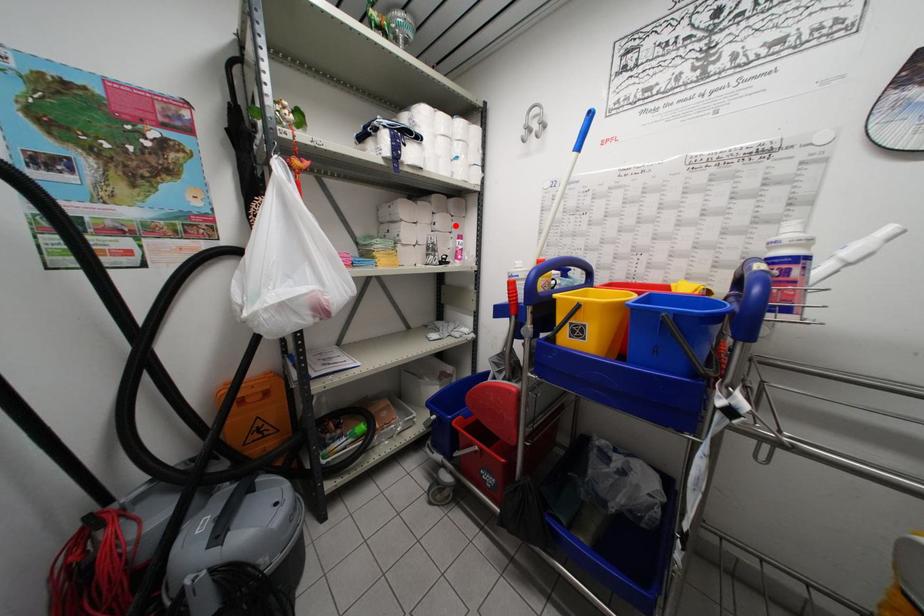
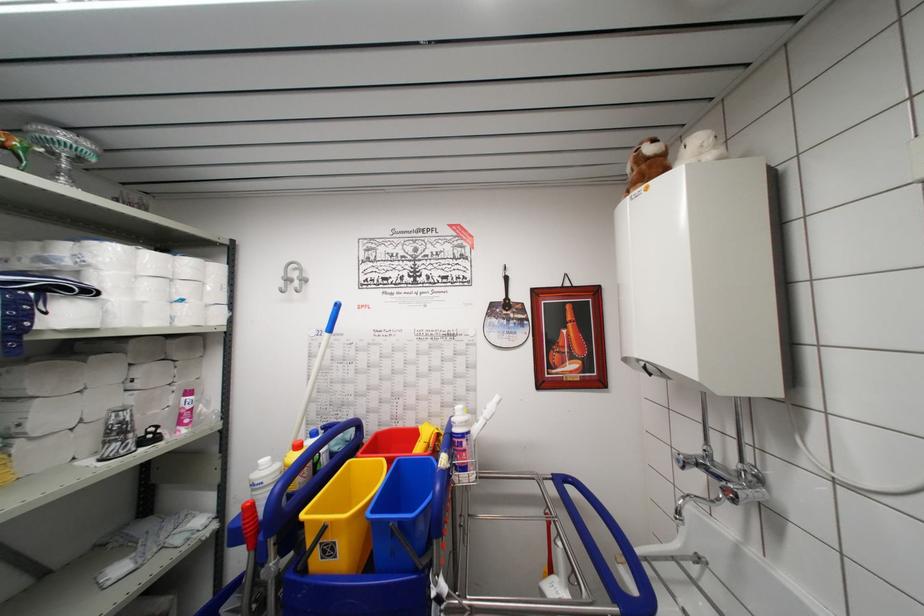
In the second image, find the point that corresponds to the highlighted location in the first image.

(178, 371)